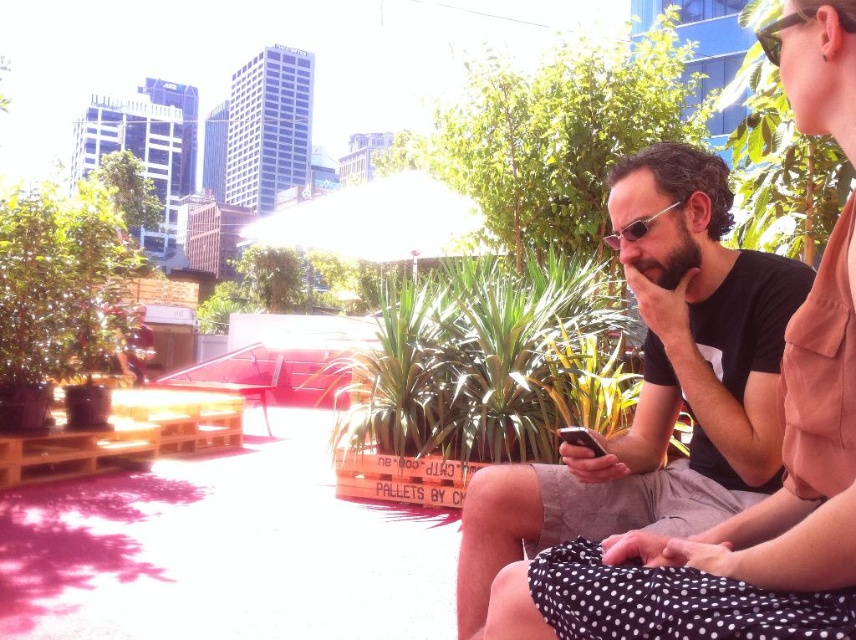
Question: Is black matte shirt at center positioned in front of sunglasses at center?

Choices:
 (A) yes
 (B) no

Answer: (A)

Question: Is sunglasses at upper right to the right of sunglasses at center from the viewer's perspective?

Choices:
 (A) yes
 (B) no

Answer: (A)

Question: Which of the following is the farthest from the observer?

Choices:
 (A) coord(571,451)
 (B) coord(852,22)

Answer: (A)

Question: Does sunglasses at upper right have a lesser width compared to sunglasses at center?

Choices:
 (A) no
 (B) yes

Answer: (A)

Question: Which point is farther to the camera?

Choices:
 (A) (608, 246)
 (B) (780, 26)

Answer: (A)

Question: Which object is farther from the camera taking this photo?

Choices:
 (A) sunglasses at center
 (B) sunglasses at upper right

Answer: (A)